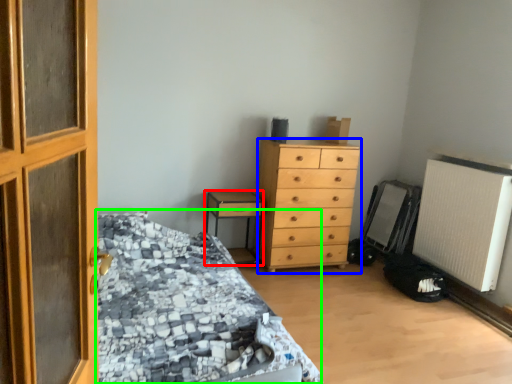
Question: Estimate the real-world distances between objects in this image. Which object is farther from nightstand (highlighted by a red box), chest of drawers (highlighted by a blue box) or bed (highlighted by a green box)?

Choices:
 (A) chest of drawers
 (B) bed

Answer: (B)